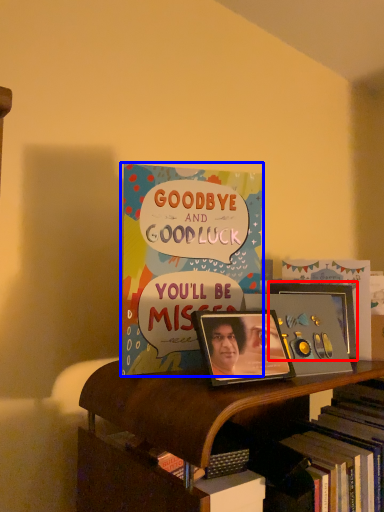
Question: Which point is further to the camera, picture frame (highlighted by a red box) or book (highlighted by a blue box)?

Choices:
 (A) picture frame
 (B) book

Answer: (A)